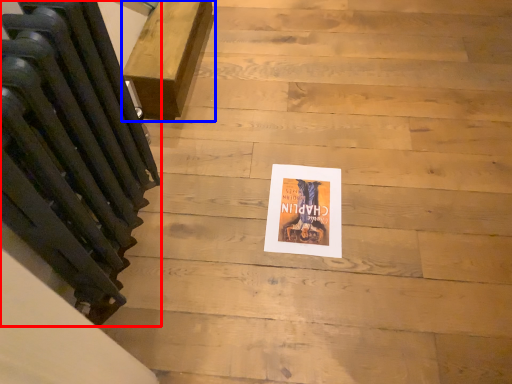
Question: Among these objects, which one is nearest to the camera, radiator (highlighted by a red box) or furniture (highlighted by a blue box)?

Choices:
 (A) radiator
 (B) furniture

Answer: (A)